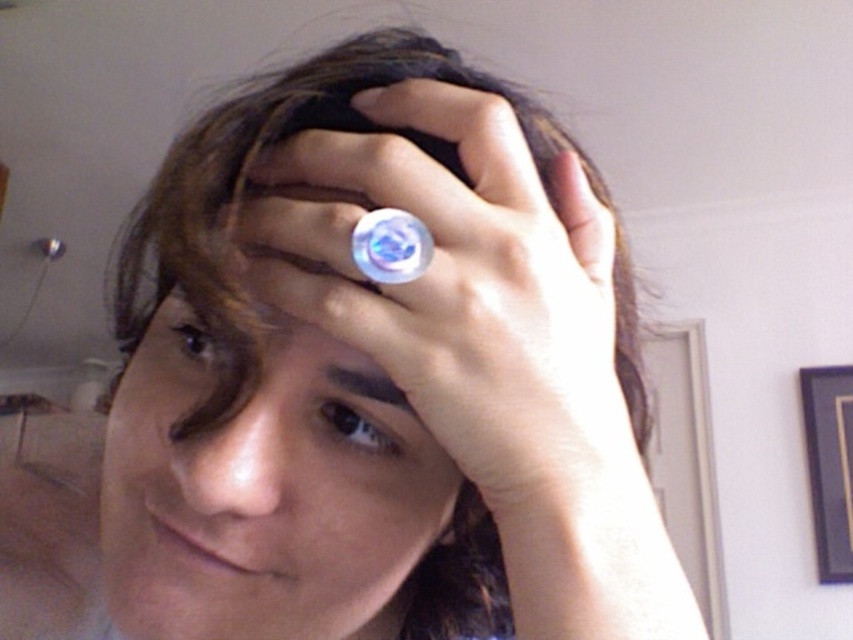
Question: Can you confirm if transparent plastic ring at center is bigger than satin black eye at center?

Choices:
 (A) yes
 (B) no

Answer: (A)

Question: Does smooth skin face at center appear over brown glossy eye at upper left?

Choices:
 (A) no
 (B) yes

Answer: (A)

Question: Which object is closer to the camera taking this photo?

Choices:
 (A) transparent plastic ring at center
 (B) brown glossy eye at upper left
 (C) smooth skin face at center
 (D) satin black eye at center

Answer: (A)

Question: Which is nearer to the brown glossy eye at upper left?

Choices:
 (A) satin black eye at center
 (B) transparent plastic ring at center

Answer: (A)

Question: Which point is farther to the camera?

Choices:
 (A) (270, 385)
 (B) (234, 355)

Answer: (A)

Question: In this image, where is brown glossy eye at upper left located relative to satin black eye at center?

Choices:
 (A) right
 (B) left

Answer: (B)